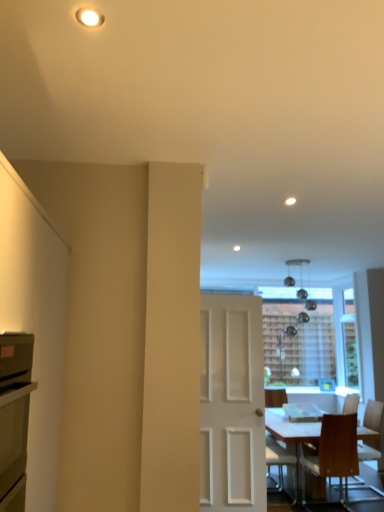
Question: Considering the relative sizes of wooden chair at lower right, which is counted as the 2th chair, starting from the left, and white matte door at center in the image provided, is wooden chair at lower right, which is counted as the 2th chair, starting from the left, taller than white matte door at center?

Choices:
 (A) no
 (B) yes

Answer: (A)

Question: Can you confirm if wooden chair at lower right, positioned as the 2th chair in right-to-left order, is thinner than white matte door at center?

Choices:
 (A) no
 (B) yes

Answer: (A)

Question: Is wooden chair at lower right, which is counted as the 2th chair, starting from the left, in contact with white matte door at center?

Choices:
 (A) yes
 (B) no

Answer: (B)

Question: Considering the relative positions of wooden chair at lower right, which is counted as the 2th chair, starting from the left, and white matte door at center in the image provided, is wooden chair at lower right, which is counted as the 2th chair, starting from the left, in front of white matte door at center?

Choices:
 (A) no
 (B) yes

Answer: (A)

Question: Does wooden chair at lower right, positioned as the 2th chair in right-to-left order, lie behind white matte door at center?

Choices:
 (A) yes
 (B) no

Answer: (A)

Question: Is wooden chair at lower right, which is the third chair in left-to-right order, in front of or behind white matte door at center in the image?

Choices:
 (A) front
 (B) behind

Answer: (B)

Question: Is point (364, 429) positioned closer to the camera than point (208, 429)?

Choices:
 (A) farther
 (B) closer

Answer: (A)

Question: Is wooden chair at lower right, which is the third chair in left-to-right order, inside the boundaries of white matte door at center, or outside?

Choices:
 (A) inside
 (B) outside

Answer: (B)

Question: From a real-world perspective, is wooden chair at lower right, marked as the first chair in a right-to-left arrangement, positioned above or below white matte door at center?

Choices:
 (A) above
 (B) below

Answer: (B)

Question: From a real-world perspective, relative to matte black oven at left, is wooden chair at lower right, which is the first chair in left-to-right order, vertically above or below?

Choices:
 (A) above
 (B) below

Answer: (B)

Question: Looking at their shapes, would you say wooden chair at lower right, placed as the 3th chair when sorted from right to left, is wider or thinner than matte black oven at left?

Choices:
 (A) thin
 (B) wide

Answer: (B)

Question: From the image's perspective, is wooden chair at lower right, placed as the 3th chair when sorted from right to left, located above or below matte black oven at left?

Choices:
 (A) above
 (B) below

Answer: (B)

Question: In the image, is wooden chair at lower right, which is the first chair in left-to-right order, on the left side or the right side of matte black oven at left?

Choices:
 (A) right
 (B) left

Answer: (A)

Question: From a real-world perspective, is wooden chair at lower right, which is the third chair in left-to-right order, physically located above or below wooden chair at lower right, which is counted as the 2th chair, starting from the left?

Choices:
 (A) above
 (B) below

Answer: (A)

Question: Considering the positions of point (347, 403) and point (336, 445), is point (347, 403) closer or farther from the camera than point (336, 445)?

Choices:
 (A) farther
 (B) closer

Answer: (A)